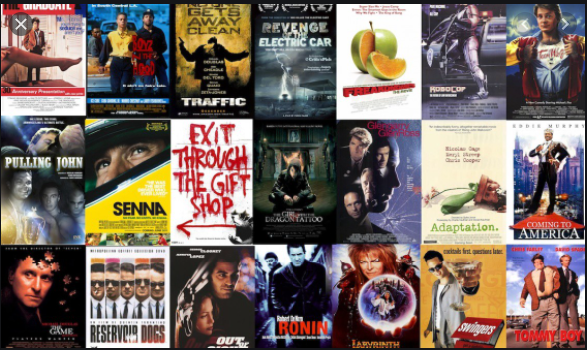
Locate an element on the screen. The width and height of the screenshot is (587, 350). total number of movies posters on the top row is located at coordinates (58, 57), (134, 68), (221, 52), (301, 55), (384, 55), (483, 49), (558, 57).